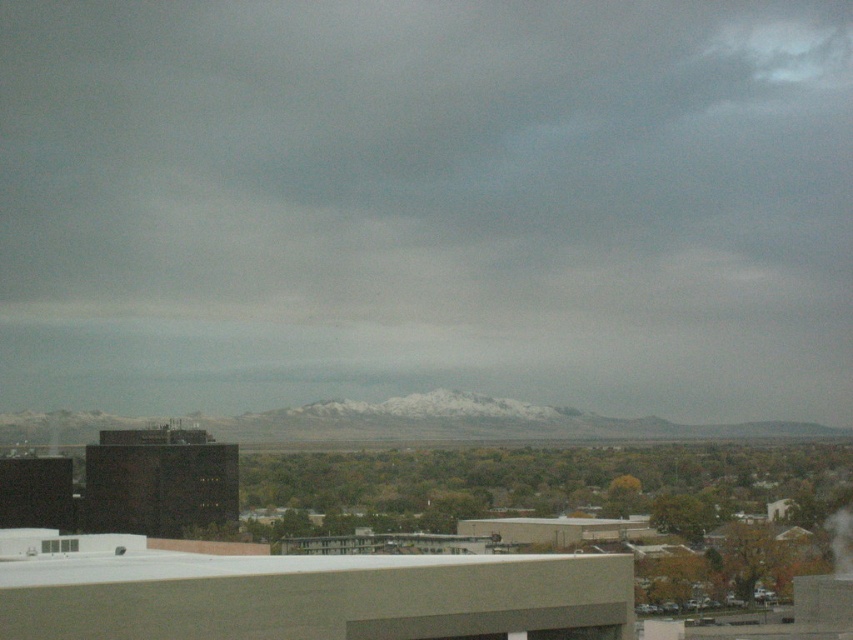
Question: Which object appears farthest from the camera in this image?

Choices:
 (A) white vapor at upper right
 (B) gray cloudy sky at upper center

Answer: (B)

Question: Can you confirm if gray cloudy sky at upper center is wider than white vapor at upper right?

Choices:
 (A) no
 (B) yes

Answer: (B)

Question: Can you confirm if gray cloudy sky at upper center is thinner than white vapor at upper right?

Choices:
 (A) yes
 (B) no

Answer: (B)

Question: Is gray cloudy sky at upper center positioned at the back of white vapor at upper right?

Choices:
 (A) no
 (B) yes

Answer: (B)

Question: Which point is farther to the camera?

Choices:
 (A) white vapor at upper right
 (B) gray cloudy sky at upper center

Answer: (B)